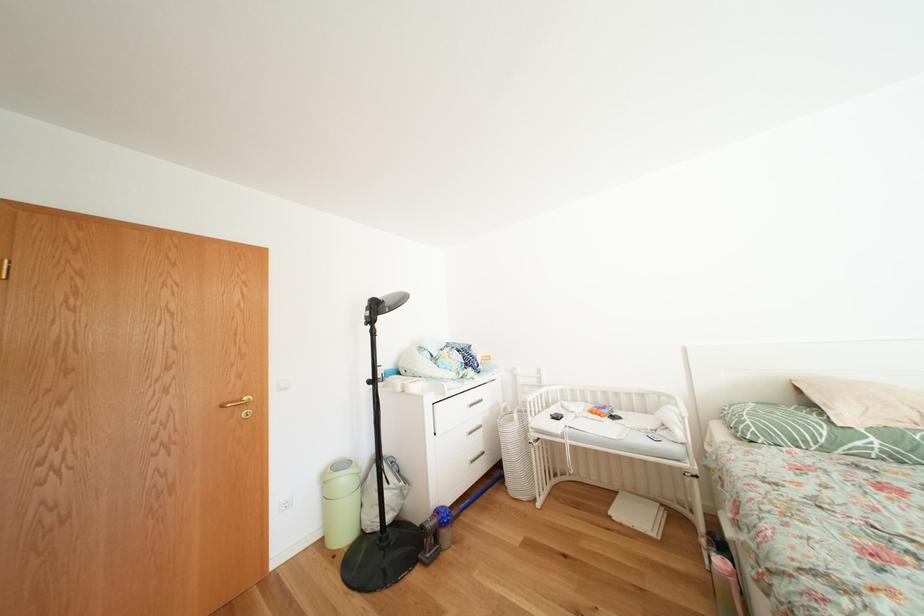
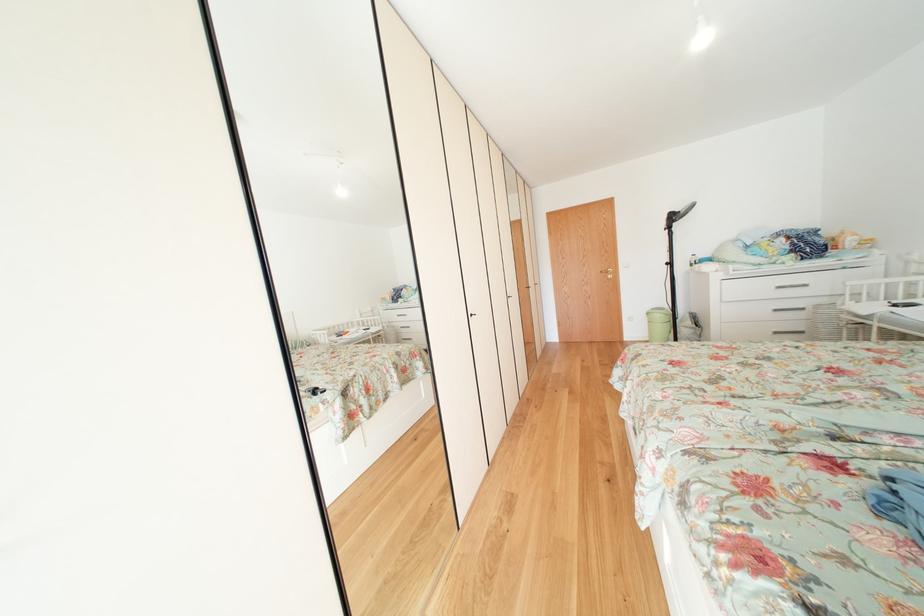
Question: I am providing you with two images of the same scene from different viewpoints. Which of the following objects are not visible in image2?

Choices:
 (A) gold door handle
 (B) black cabinet lock
 (C) green trash can
 (D) none of these

Answer: (D)